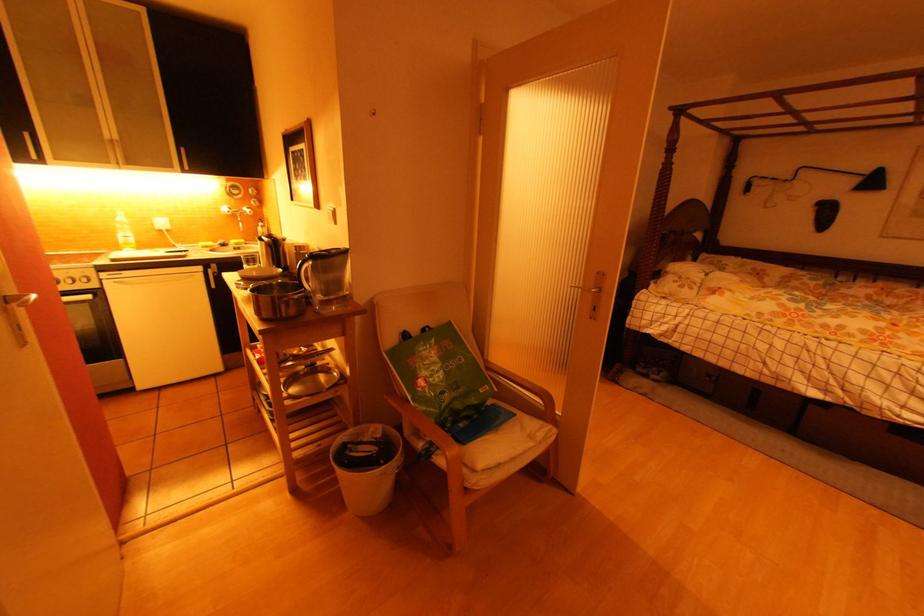
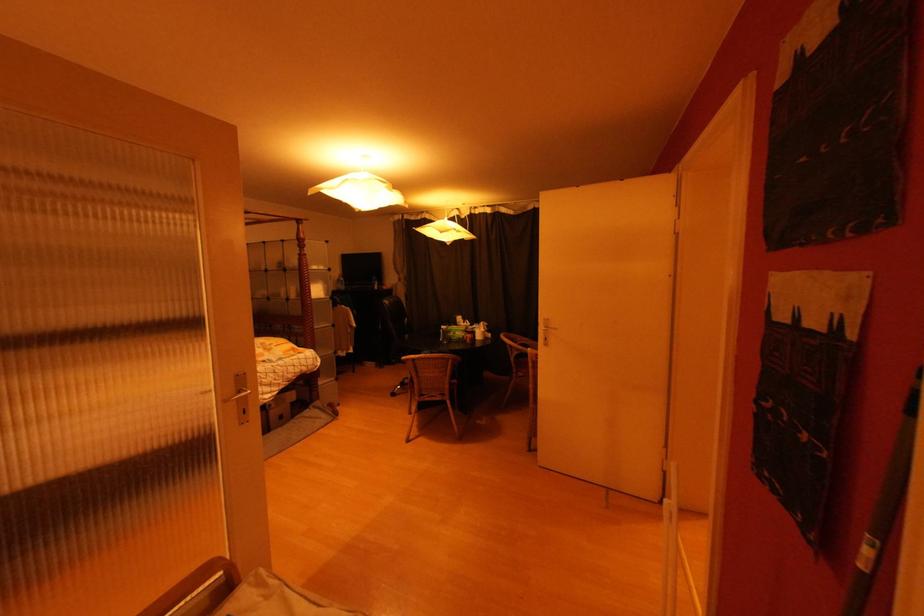
The point at (600, 310) is marked in the first image. Where is the corresponding point in the second image?

(249, 415)